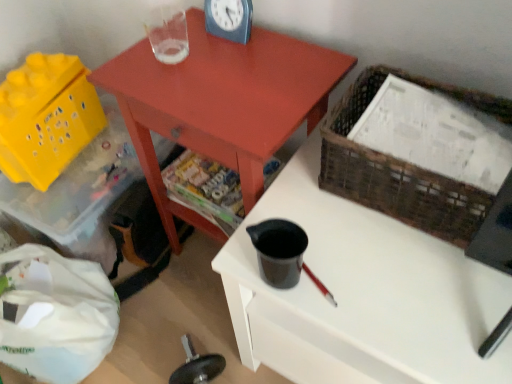
Question: Does yellow plastic basket at lower left, which is counted as the first basket, starting from the left, have a lesser height compared to woven brown basket at upper right, the 2th basket from the back?

Choices:
 (A) yes
 (B) no

Answer: (B)

Question: Is yellow plastic basket at lower left, acting as the second basket starting from the right, turned away from woven brown basket at upper right, which is the second basket in left-to-right order?

Choices:
 (A) yes
 (B) no

Answer: (B)

Question: Is yellow plastic basket at lower left, which is counted as the first basket, starting from the left, taller than woven brown basket at upper right, which is the second basket in left-to-right order?

Choices:
 (A) yes
 (B) no

Answer: (A)

Question: From a real-world perspective, is yellow plastic basket at lower left, acting as the second basket starting from the right, positioned over woven brown basket at upper right, the first basket viewed from the front, based on gravity?

Choices:
 (A) yes
 (B) no

Answer: (B)

Question: Does yellow plastic basket at lower left, the second basket positioned from the front, appear on the right side of woven brown basket at upper right, the first basket viewed from the front?

Choices:
 (A) yes
 (B) no

Answer: (B)

Question: In terms of width, does black plastic cup at center look wider or thinner when compared to blue plastic clock at upper center?

Choices:
 (A) thin
 (B) wide

Answer: (B)

Question: Does point (506, 281) appear closer or farther from the camera than point (215, 11)?

Choices:
 (A) farther
 (B) closer

Answer: (B)

Question: Is black plastic cup at center bigger or smaller than blue plastic clock at upper center?

Choices:
 (A) big
 (B) small

Answer: (A)

Question: Is black plastic cup at center inside or outside of blue plastic clock at upper center?

Choices:
 (A) outside
 (B) inside

Answer: (A)

Question: Considering the relative positions of yellow plastic storage box at lower left and black plastic cup at center in the image provided, is yellow plastic storage box at lower left to the left or to the right of black plastic cup at center?

Choices:
 (A) right
 (B) left

Answer: (B)

Question: From the image's perspective, is yellow plastic storage box at lower left located above or below black plastic cup at center?

Choices:
 (A) below
 (B) above

Answer: (B)

Question: Considering the positions of yellow plastic storage box at lower left and black plastic cup at center in the image, is yellow plastic storage box at lower left taller or shorter than black plastic cup at center?

Choices:
 (A) short
 (B) tall

Answer: (A)

Question: Considering the positions of yellow plastic storage box at lower left and black plastic cup at center in the image, is yellow plastic storage box at lower left wider or thinner than black plastic cup at center?

Choices:
 (A) thin
 (B) wide

Answer: (B)

Question: From the image's perspective, is woven brown basket at upper right, which appears as the first basket when viewed from the right, positioned above or below yellow plastic storage box at lower left?

Choices:
 (A) below
 (B) above

Answer: (B)

Question: Visually, is woven brown basket at upper right, the first basket viewed from the front, positioned to the left or to the right of yellow plastic storage box at lower left?

Choices:
 (A) left
 (B) right

Answer: (B)